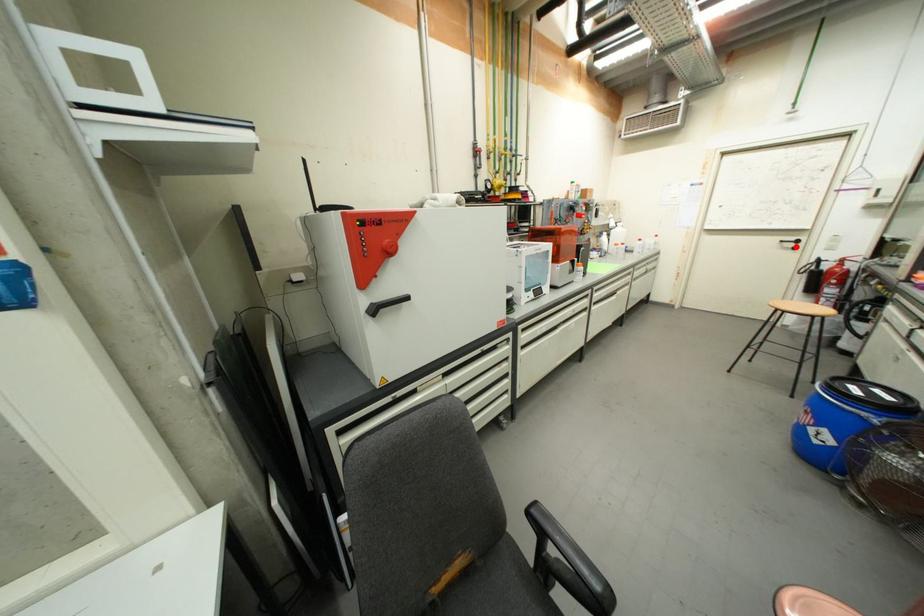
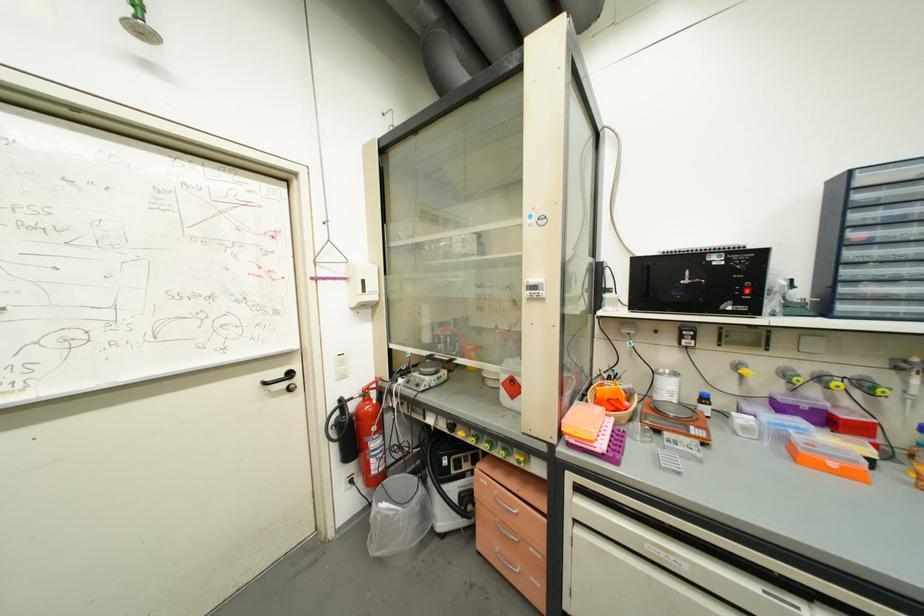
Where in the second image is the point corresponding to the highlighted location from the first image?

(289, 387)